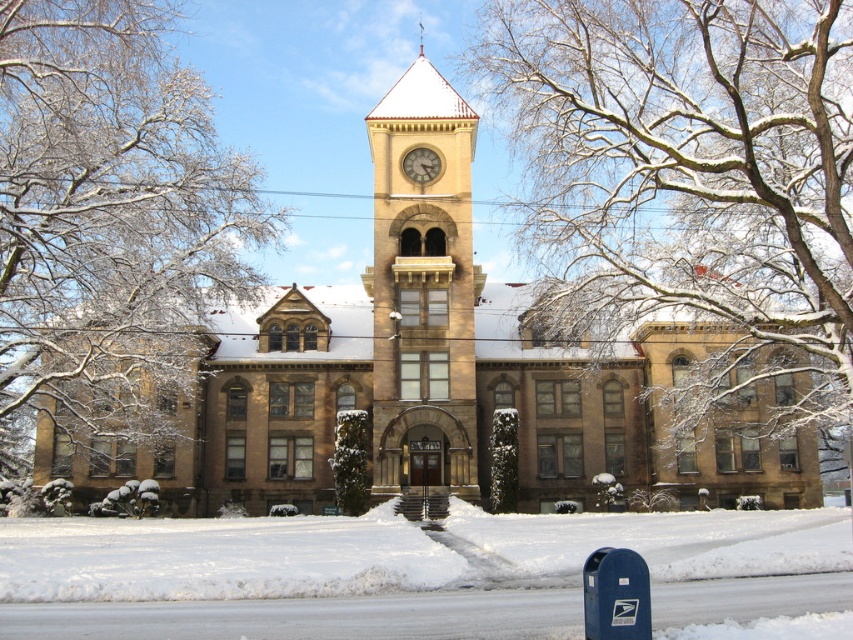
Question: Is snow-covered branches at upper center smaller than snow-covered branches at upper left?

Choices:
 (A) no
 (B) yes

Answer: (A)

Question: Considering the real-world distances, which object is farthest from the brown stone church at center?

Choices:
 (A) snow-covered branches at upper center
 (B) snow-covered branches at upper left
 (C) matte brown clock at center
 (D) brown stone clock tower at center

Answer: (C)

Question: Is snow-covered branches at upper center positioned in front of snow-covered branches at upper left?

Choices:
 (A) no
 (B) yes

Answer: (B)

Question: Is brown stone church at center to the right of snow-covered branches at upper center from the viewer's perspective?

Choices:
 (A) yes
 (B) no

Answer: (B)

Question: Considering the real-world distances, which object is closest to the brown stone church at center?

Choices:
 (A) snow-covered branches at upper left
 (B) matte brown clock at center
 (C) brown stone clock tower at center
 (D) snow-covered branches at upper center

Answer: (C)

Question: Which of the following is the farthest from the observer?

Choices:
 (A) (320, 392)
 (B) (630, 316)
 (C) (469, 316)

Answer: (A)